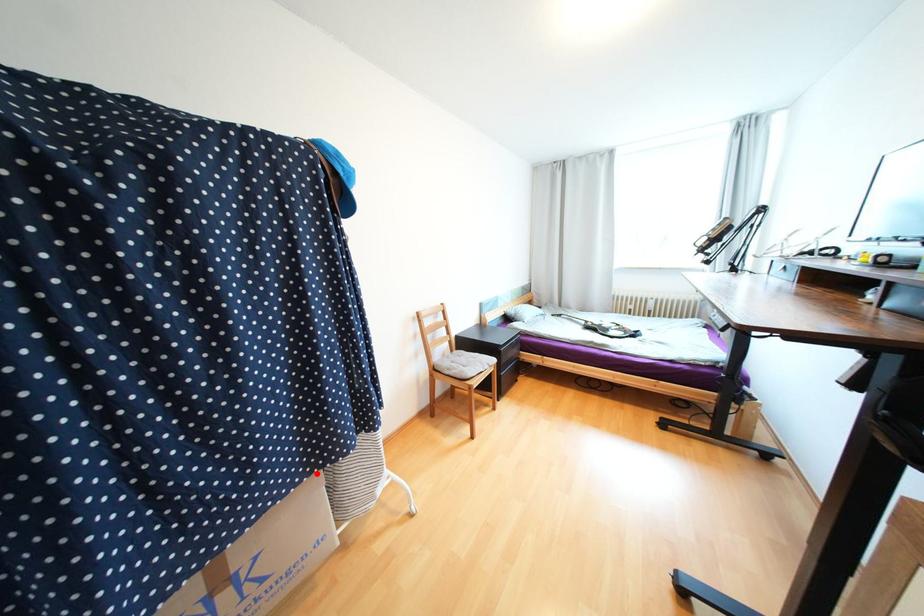
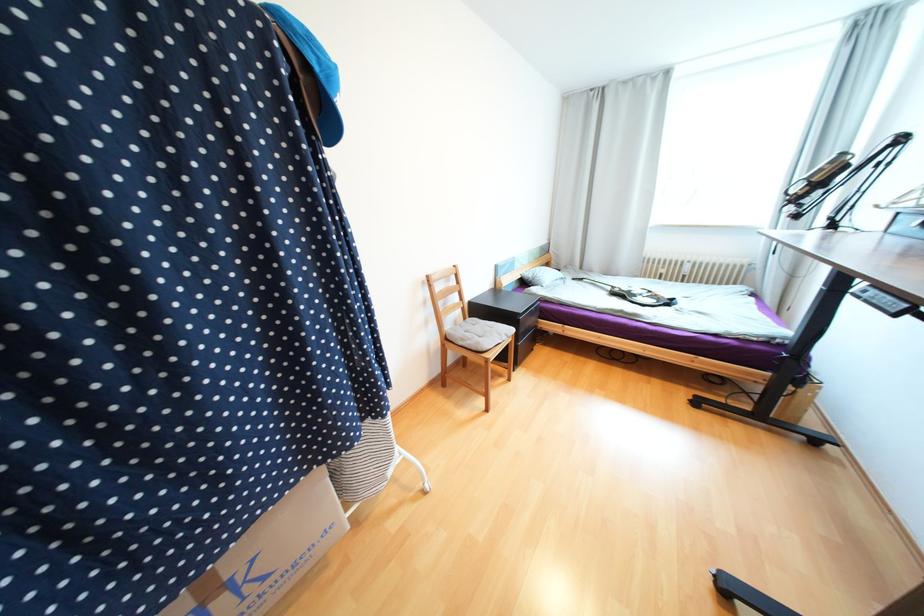
Locate, in the second image, the point that corresponds to the highlighted location in the first image.

(314, 471)